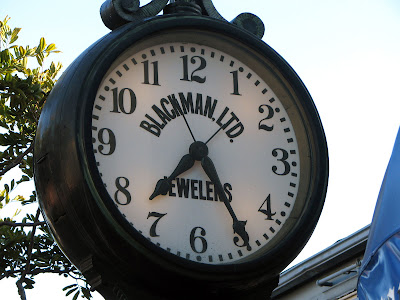
This screenshot has height=300, width=400. Identify the location of clock hands. (186, 164).